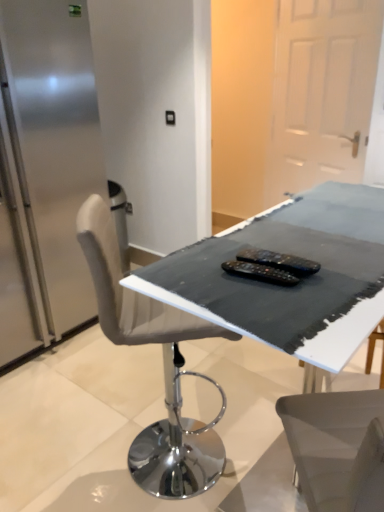
Identify the location of vacant area located to the right-hand side of black plastic remote controls at center, acting as the 1th equipment starting from the bottom. Image resolution: width=384 pixels, height=512 pixels. (334, 273).